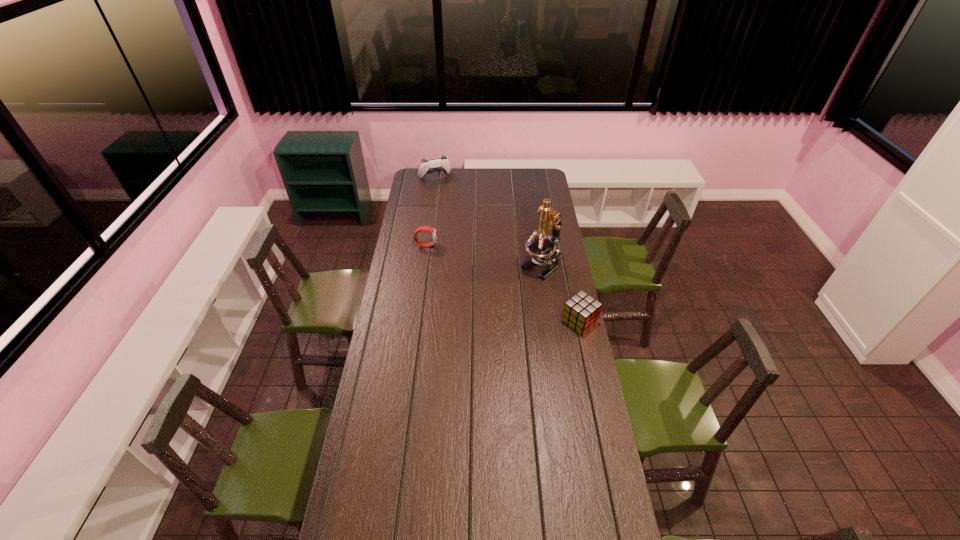
Where is `free space located 0.140m on the front-facing side of the farthest object`? The image size is (960, 540). free space located 0.140m on the front-facing side of the farthest object is located at coordinates (444, 193).

At what (x,y) coordinates should I click in order to perform the action: click on vacant space located on the front-facing side of the farthest object. Please return your answer as a coordinate pair (x, y). Looking at the image, I should click on (442, 187).

Find the location of `free spot located 0.150m on the front-facing side of the farthest object`. free spot located 0.150m on the front-facing side of the farthest object is located at coordinates click(445, 194).

Locate an element on the screen. object located at the far edge is located at coordinates (441, 164).

Identify the location of watch at the left edge. The width and height of the screenshot is (960, 540). (425, 228).

Image resolution: width=960 pixels, height=540 pixels. Find the location of `control at the left edge`. control at the left edge is located at coordinates (441, 164).

Identify the location of cube present at the right edge. [x=581, y=312].

Identify the location of microscope present at the right edge. (542, 248).

You are a GUI agent. You are given a task and a screenshot of the screen. Output one action in this format:
    pyautogui.click(x=<x>, y=<y>)
    Task: Click on the object that is at the far left corner
    Image resolution: width=960 pixels, height=540 pixels.
    Given the screenshot: What is the action you would take?
    pyautogui.click(x=441, y=164)

In the image, there is a desktop. What are the coordinates of `free region at the near edge` in the screenshot? It's located at click(500, 528).